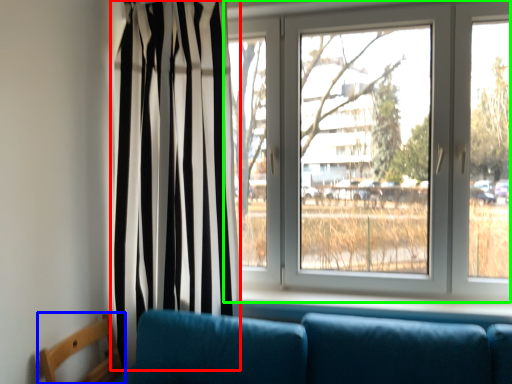
Question: Considering the real-world distances, which object is closest to curtain (highlighted by a red box)? furniture (highlighted by a blue box) or window (highlighted by a green box).

Choices:
 (A) furniture
 (B) window

Answer: (B)